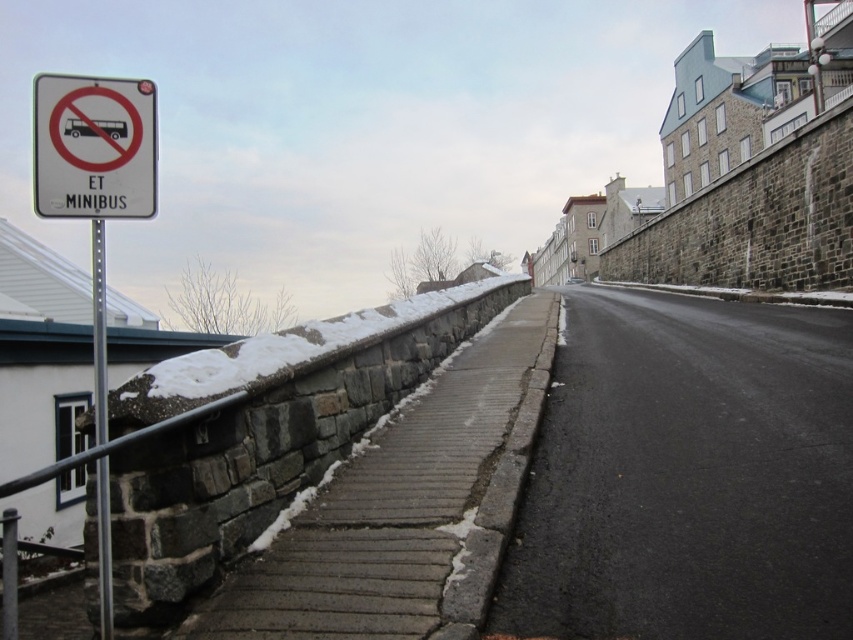
Which is more to the right, white plastic sign at upper left or metallic pole at left?

metallic pole at left

Can you confirm if white plastic sign at upper left is smaller than metallic pole at left?

Actually, white plastic sign at upper left might be larger than metallic pole at left.

What do you see at coordinates (93, 147) in the screenshot? I see `white plastic sign at upper left` at bounding box center [93, 147].

This screenshot has height=640, width=853. I want to click on white plastic sign at upper left, so click(93, 147).